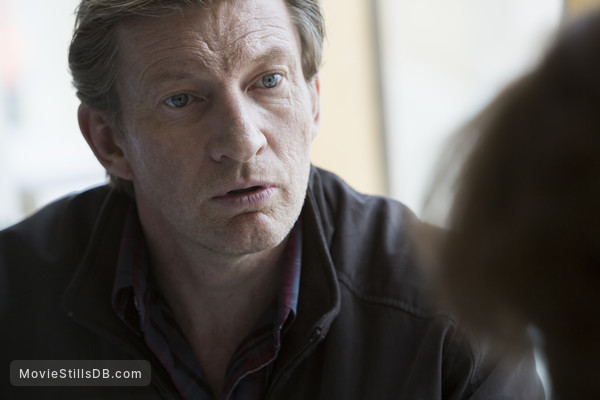
The height and width of the screenshot is (400, 600). In order to click on wall in this screenshot , I will do `click(365, 111)`.